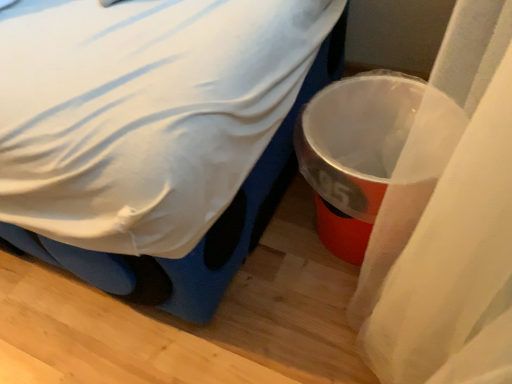
Question: From the image's perspective, is white fabric bed at center located above or below metallic plastic trash can at right?

Choices:
 (A) above
 (B) below

Answer: (A)

Question: Is white fabric bed at center bigger or smaller than metallic plastic trash can at right?

Choices:
 (A) small
 (B) big

Answer: (B)

Question: Does point (154, 190) appear closer or farther from the camera than point (329, 233)?

Choices:
 (A) closer
 (B) farther

Answer: (A)

Question: Is metallic plastic trash can at right to the left or to the right of white fabric bed at center in the image?

Choices:
 (A) right
 (B) left

Answer: (A)

Question: From a real-world perspective, is metallic plastic trash can at right above or below white fabric bed at center?

Choices:
 (A) above
 (B) below

Answer: (B)

Question: From the image's perspective, is metallic plastic trash can at right above or below white fabric bed at center?

Choices:
 (A) above
 (B) below

Answer: (B)

Question: In the image, is metallic plastic trash can at right positioned in front of or behind white fabric bed at center?

Choices:
 (A) behind
 (B) front

Answer: (A)